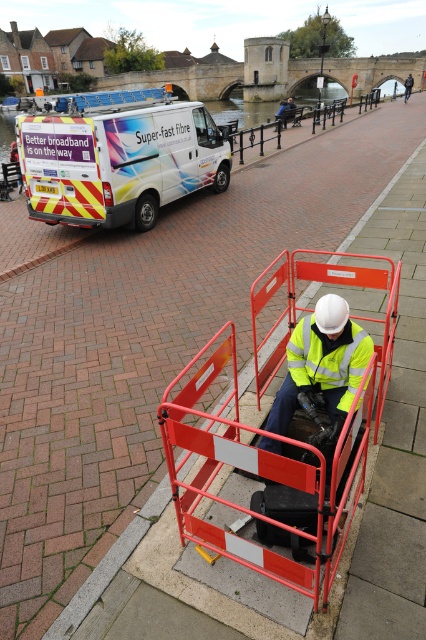
Question: Is white glossy van at upper left to the left of yellow high-visibility fabric safety vest at center from the viewer's perspective?

Choices:
 (A) no
 (B) yes

Answer: (B)

Question: Is white glossy van at upper left behind yellow high-visibility fabric safety vest at center?

Choices:
 (A) yes
 (B) no

Answer: (A)

Question: Is white glossy van at upper left closer to camera compared to yellow high-visibility fabric safety vest at center?

Choices:
 (A) yes
 (B) no

Answer: (B)